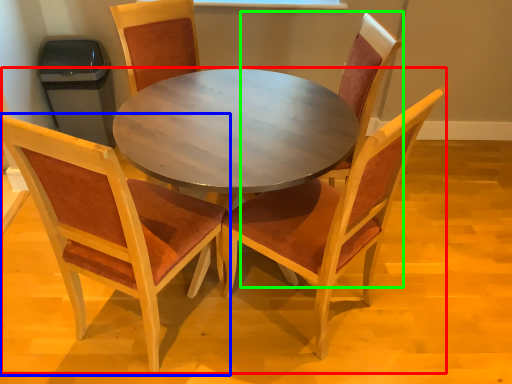
Question: Estimate the real-world distances between objects in this image. Which object is farther from kitchen & dining room table (highlighted by a red box), chair (highlighted by a blue box) or chair (highlighted by a green box)?

Choices:
 (A) chair
 (B) chair

Answer: (B)